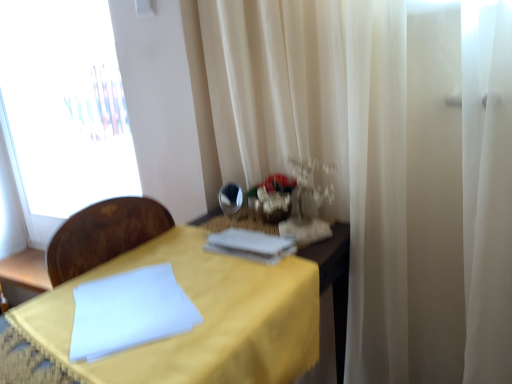
The width and height of the screenshot is (512, 384). I want to click on free region on the left part of white paper at center, so tap(178, 256).